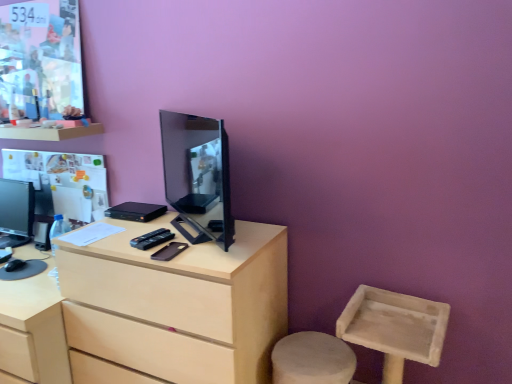
This screenshot has height=384, width=512. What are the coordinates of `vacant space that is in between black plastic remote control at center and black matte mobile phone at center` in the screenshot? It's located at (164, 241).